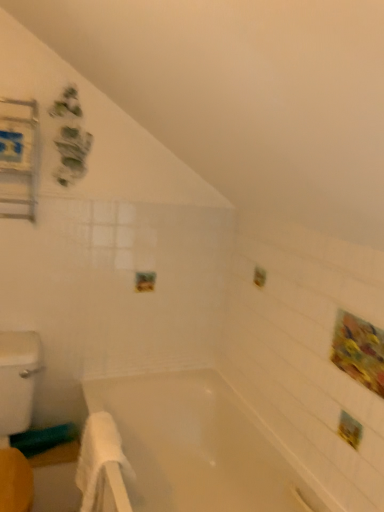
The image size is (384, 512). Describe the element at coordinates (198, 446) in the screenshot. I see `white glossy bathtub at center` at that location.

What do you see at coordinates (19, 158) in the screenshot?
I see `metallic silver medicine cabinet at upper left` at bounding box center [19, 158].

At what (x,y) coordinates should I click in order to perform the action: click on metallic silver medicine cabinet at upper left. Please return your answer as a coordinate pair (x, y). This screenshot has height=512, width=384. Looking at the image, I should click on (19, 158).

This screenshot has width=384, height=512. I want to click on white glossy bathtub at center, so click(198, 446).

Is metallic silver medicine cabinet at upper left turned away from white soft towel at lower left?

No, white soft towel at lower left is not at the back of metallic silver medicine cabinet at upper left.

From the image's perspective, relative to white soft towel at lower left, is metallic silver medicine cabinet at upper left above or below?

From the image's perspective, metallic silver medicine cabinet at upper left appears above white soft towel at lower left.

Which of these two, metallic silver medicine cabinet at upper left or white soft towel at lower left, is bigger?

white soft towel at lower left.

From the picture: Is metallic silver medicine cabinet at upper left to the right of white soft towel at lower left from the viewer's perspective?

No.

How many degrees apart are the facing directions of white soft towel at lower left and white glossy bathtub at center?

The angle between the facing direction of white soft towel at lower left and the facing direction of white glossy bathtub at center is 3.31 degrees.

Is white glossy bathtub at center a part of white soft towel at lower left?

No, white glossy bathtub at center is located outside of white soft towel at lower left.

Are white soft towel at lower left and white glossy bathtub at center making contact?

No, white soft towel at lower left is not with white glossy bathtub at center.

Locate an element on the screen. The image size is (384, 512). bathtub below the white soft towel at lower left (from a real-world perspective) is located at coordinates (198, 446).

Considering the relative positions of metallic silver medicine cabinet at upper left and white glossy bathtub at center in the image provided, is metallic silver medicine cabinet at upper left to the right of white glossy bathtub at center from the viewer's perspective?

In fact, metallic silver medicine cabinet at upper left is to the left of white glossy bathtub at center.

From the image's perspective, relative to white glossy bathtub at center, is metallic silver medicine cabinet at upper left above or below?

Clearly, from the image's perspective, metallic silver medicine cabinet at upper left is above white glossy bathtub at center.

Can you confirm if metallic silver medicine cabinet at upper left is shorter than white glossy bathtub at center?

Yes.

Is metallic silver medicine cabinet at upper left closer to camera compared to white glossy bathtub at center?

No, metallic silver medicine cabinet at upper left is further to the viewer.

Can you see white glossy bathtub at center touching white soft towel at lower left?

No, white glossy bathtub at center is not touching white soft towel at lower left.

From a real-world perspective, who is located higher, white glossy bathtub at center or white soft towel at lower left?

From a 3D spatial view, white soft towel at lower left is above.

Considering the relative positions of white glossy bathtub at center and white soft towel at lower left in the image provided, is white glossy bathtub at center to the left or to the right of white soft towel at lower left?

white glossy bathtub at center is positioned on white soft towel at lower left's right side.

From the image's perspective, which one is positioned lower, white glossy bathtub at center or white soft towel at lower left?

white glossy bathtub at center appears lower in the image.

Is white soft towel at lower left not close to metallic silver medicine cabinet at upper left?

That's not correct — white soft towel at lower left is a little close to metallic silver medicine cabinet at upper left.

In terms of size, does white soft towel at lower left appear bigger or smaller than metallic silver medicine cabinet at upper left?

Considering their sizes, white soft towel at lower left takes up more space than metallic silver medicine cabinet at upper left.

Which object is further away from the camera taking this photo, white soft towel at lower left or metallic silver medicine cabinet at upper left?

Positioned behind is metallic silver medicine cabinet at upper left.

From a real-world perspective, relative to metallic silver medicine cabinet at upper left, is white soft towel at lower left vertically above or below?

Clearly, from a real-world perspective, white soft towel at lower left is below metallic silver medicine cabinet at upper left.

Can we say white glossy bathtub at center lies outside metallic silver medicine cabinet at upper left?

That's correct, white glossy bathtub at center is outside of metallic silver medicine cabinet at upper left.

From the image's perspective, is white glossy bathtub at center located above metallic silver medicine cabinet at upper left?

No, from the image's perspective, white glossy bathtub at center is not over metallic silver medicine cabinet at upper left.

You are a GUI agent. You are given a task and a screenshot of the screen. Output one action in this format:
    pyautogui.click(x=<x>, y=<y>)
    Task: Click on the bathtub lying below the metallic silver medicine cabinet at upper left (from the image's perspective)
    This screenshot has height=512, width=384.
    Given the screenshot: What is the action you would take?
    pyautogui.click(x=198, y=446)

How different are the orientations of white glossy bathtub at center and metallic silver medicine cabinet at upper left in degrees?

white glossy bathtub at center and metallic silver medicine cabinet at upper left are facing 90.7 degrees away from each other.

Locate an element on the screen. bath towel below the metallic silver medicine cabinet at upper left (from the image's perspective) is located at coordinates (102, 465).

Locate an element on the screen. The width and height of the screenshot is (384, 512). bath towel on the left of the white glossy bathtub at center is located at coordinates (102, 465).

From the image, which object appears to be nearer to white soft towel at lower left, metallic silver medicine cabinet at upper left or white glossy bathtub at center?

The object closer to white soft towel at lower left is white glossy bathtub at center.

Estimate the real-world distances between objects in this image. Which object is further from metallic silver medicine cabinet at upper left, white soft towel at lower left or white glossy bathtub at center?

white glossy bathtub at center.

When comparing their distances from white glossy bathtub at center, does white soft towel at lower left or metallic silver medicine cabinet at upper left seem closer?

The object closer to white glossy bathtub at center is white soft towel at lower left.

From the image, which object appears to be farther from white glossy bathtub at center, metallic silver medicine cabinet at upper left or white soft towel at lower left?

Among the two, metallic silver medicine cabinet at upper left is located further to white glossy bathtub at center.

Based on their spatial positions, is white glossy bathtub at center or metallic silver medicine cabinet at upper left further from white soft towel at lower left?

metallic silver medicine cabinet at upper left lies further to white soft towel at lower left than the other object.

When comparing their distances from metallic silver medicine cabinet at upper left, does white glossy bathtub at center or white soft towel at lower left seem closer?

A: white soft towel at lower left is closer to metallic silver medicine cabinet at upper left.

At what (x,y) coordinates should I click in order to perform the action: click on bath towel between metallic silver medicine cabinet at upper left and white glossy bathtub at center from top to bottom. Please return your answer as a coordinate pair (x, y). Image resolution: width=384 pixels, height=512 pixels. Looking at the image, I should click on (102, 465).